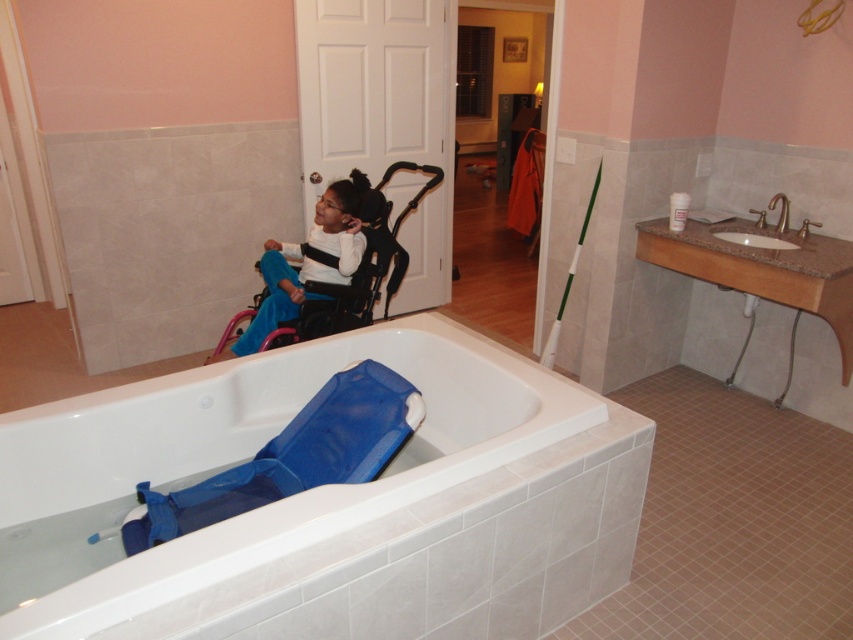
Question: Which object is closer to the camera taking this photo?

Choices:
 (A) white plastic bathtub at lower left
 (B) blue mesh baby carriage at lower left
 (C) matte black wheelchair at upper left

Answer: (A)

Question: Can you confirm if blue mesh baby carriage at lower left is bigger than white marble sink at upper right?

Choices:
 (A) yes
 (B) no

Answer: (A)

Question: Does matte black wheelchair at upper left appear on the right side of white marble sink at upper right?

Choices:
 (A) yes
 (B) no

Answer: (B)

Question: Which object is positioned closest to the white plastic bathtub at lower left?

Choices:
 (A) blue mesh baby carriage at lower left
 (B) matte black wheelchair at upper left

Answer: (A)

Question: Based on their relative distances, which object is nearer to the matte black wheelchair at upper left?

Choices:
 (A) blue mesh baby carriage at lower left
 (B) white marble sink at upper right

Answer: (A)

Question: Observing the image, what is the correct spatial positioning of white plastic bathtub at lower left in reference to blue mesh baby carriage at lower left?

Choices:
 (A) below
 (B) above

Answer: (B)